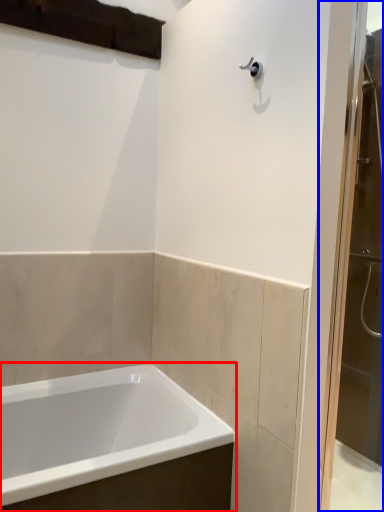
Question: Which object appears farthest to the camera in this image, bathtub (highlighted by a red box) or screen door (highlighted by a blue box)?

Choices:
 (A) bathtub
 (B) screen door

Answer: (B)